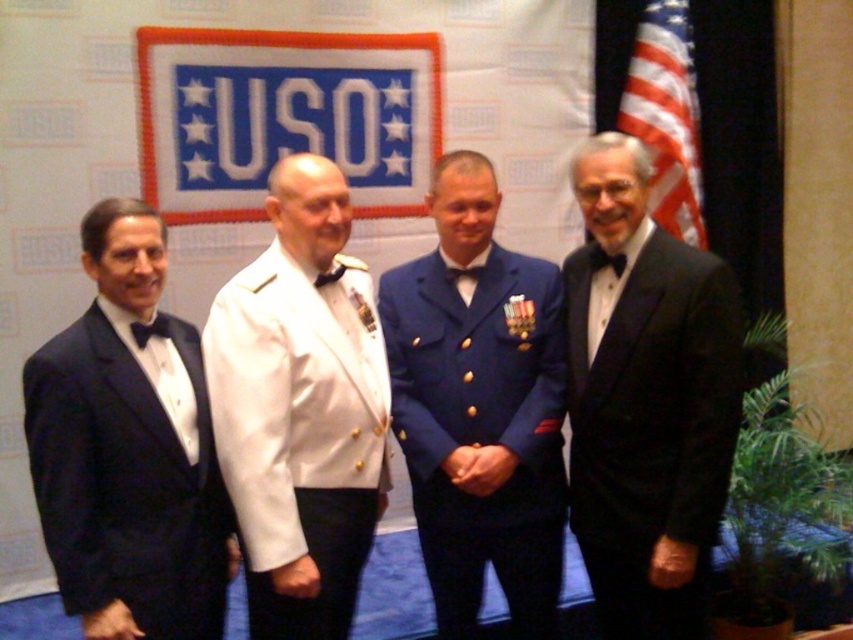
Between point (645, 416) and point (381, 356), which one is positioned behind?

Point (381, 356)

Does point (701, 392) come behind point (206, 330)?

No, (701, 392) is in front of (206, 330).

Identify the location of black satin tuxedo at right. The image size is (853, 640). (646, 400).

Does white glossy uniform at center appear on the left side of blue fabric uniform at center?

Indeed, white glossy uniform at center is positioned on the left side of blue fabric uniform at center.

Who is more distant from viewer, (x=316, y=545) or (x=476, y=177)?

The point (x=476, y=177) is more distant.

Identify the location of white glossy uniform at center. The width and height of the screenshot is (853, 640). (300, 408).

Based on the photo, can you confirm if white glossy uniform at center is thinner than matte black tuxedo at left?

No, white glossy uniform at center is not thinner than matte black tuxedo at left.

Between point (349, 536) and point (105, 310), which one is positioned behind?

The point (349, 536) is more distant.

Find the location of a particular element. white glossy uniform at center is located at coordinates (300, 408).